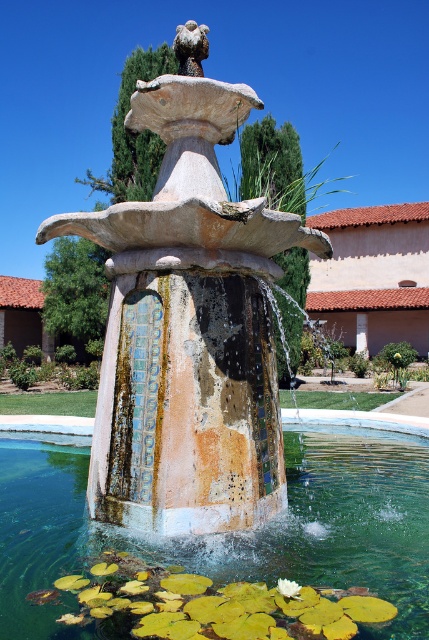
You are designing a garden layout and need to place a new decorative item between the mosaic stone fountain at center and the translucent glass bowl at center. Which object should you place the item closer to if you want it to be farther from the wider object?

The translucent glass bowl at center is wider than the mosaic stone fountain at center. To place the item farther from the wider object, you should position it closer to the mosaic stone fountain at center.

You are designing a garden layout and want to place a small statue between the mosaic stone fountain at center and the translucent glass bowl at center. Which object should the statue be closer to if you want it to appear balanced in height?

The statue should be closer to the translucent glass bowl at center because the mosaic stone fountain at center is taller, so placing the statue nearer to the shorter object will create a balanced appearance.